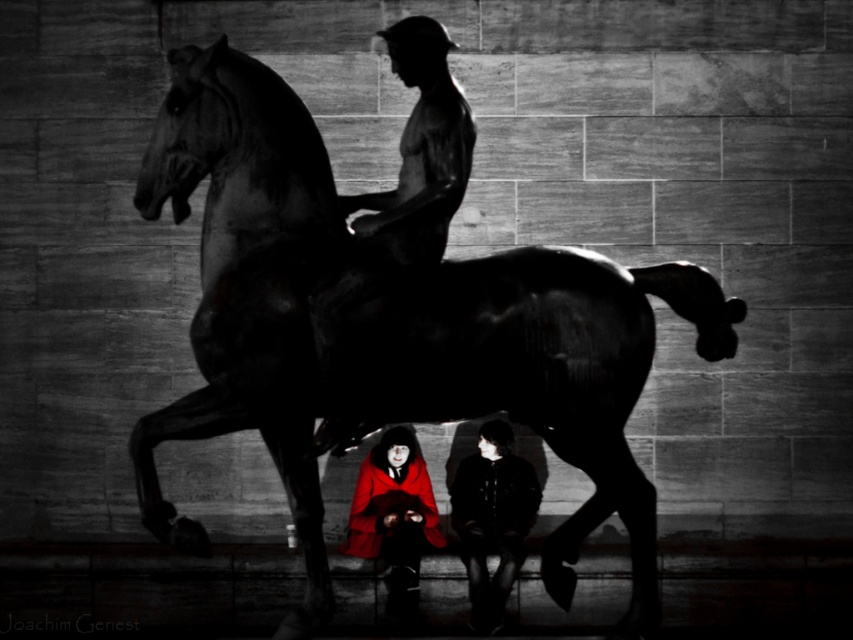
Can you confirm if black polished statue at center is bigger than black leather jacket at lower center?

Yes.

What do you see at coordinates (389, 330) in the screenshot? I see `black polished statue at center` at bounding box center [389, 330].

Is point (561, 416) positioned before point (474, 588)?

Yes, it is.

The image size is (853, 640). I want to click on black polished statue at center, so click(x=389, y=330).

Is black polished statue at center bigger than smooth dark skin at center?

Indeed, black polished statue at center has a larger size compared to smooth dark skin at center.

Which is in front, point (622, 308) or point (375, 212)?

Point (622, 308) is more forward.

The height and width of the screenshot is (640, 853). I want to click on black polished statue at center, so click(x=389, y=330).

Is black leather jacket at lower center in front of red velvet cloak at center?

Yes, it is in front of red velvet cloak at center.

Can you confirm if black leather jacket at lower center is bigger than red velvet cloak at center?

Yes.

Is point (531, 465) in front of point (415, 460)?

No, it is not.

Image resolution: width=853 pixels, height=640 pixels. I want to click on black leather jacket at lower center, so click(492, 518).